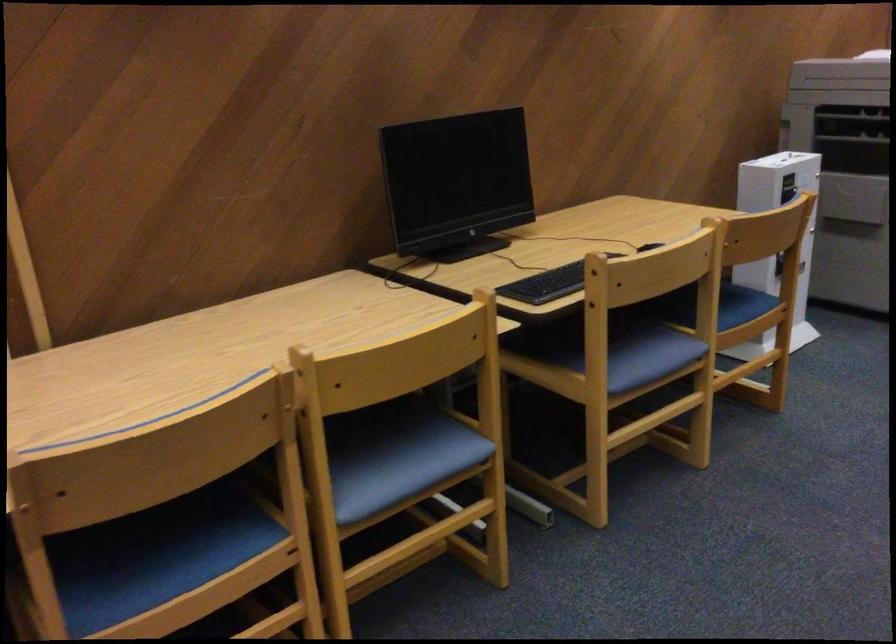
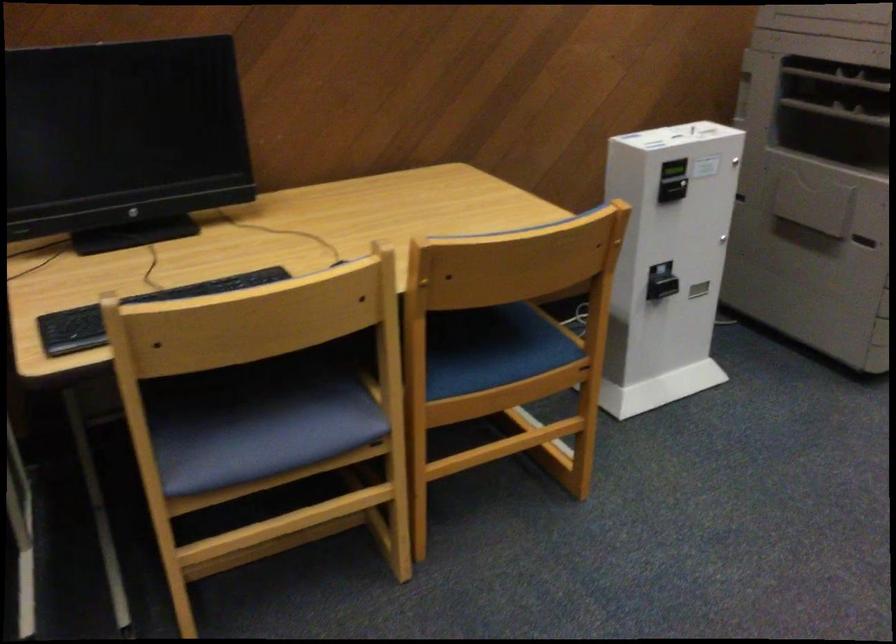
Where in the second image is the point corresponding to the point at 596,260 from the first image?

(134, 310)